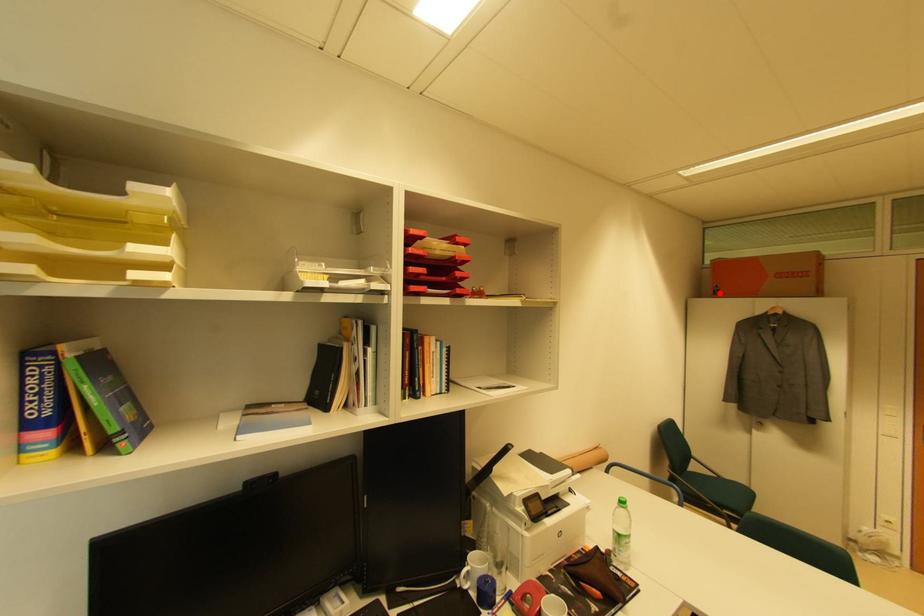
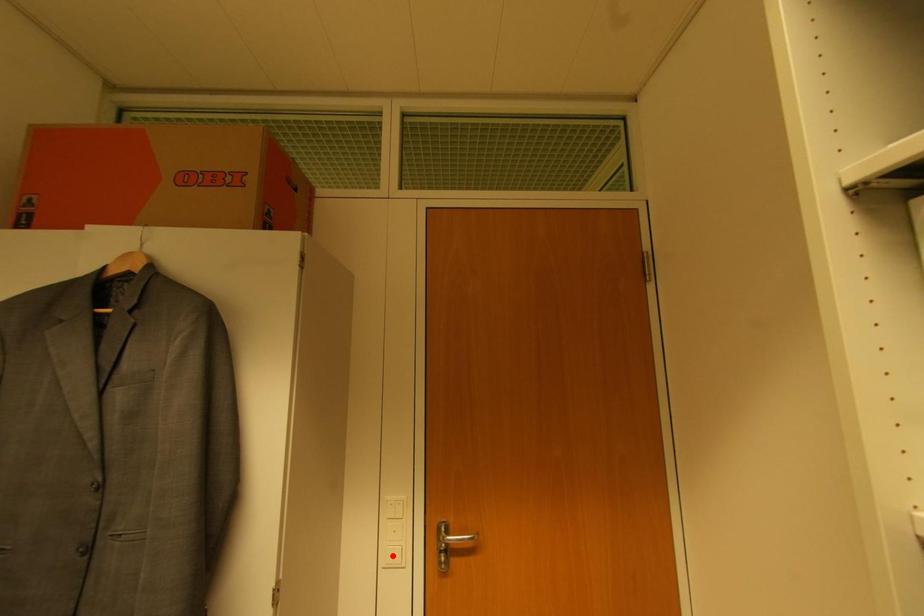
I am providing you with two images of the same scene from different viewpoints. A red point is marked on the first image and another point is marked on the second image. Is the red point in image1 aligned with the point shown in image2?

No